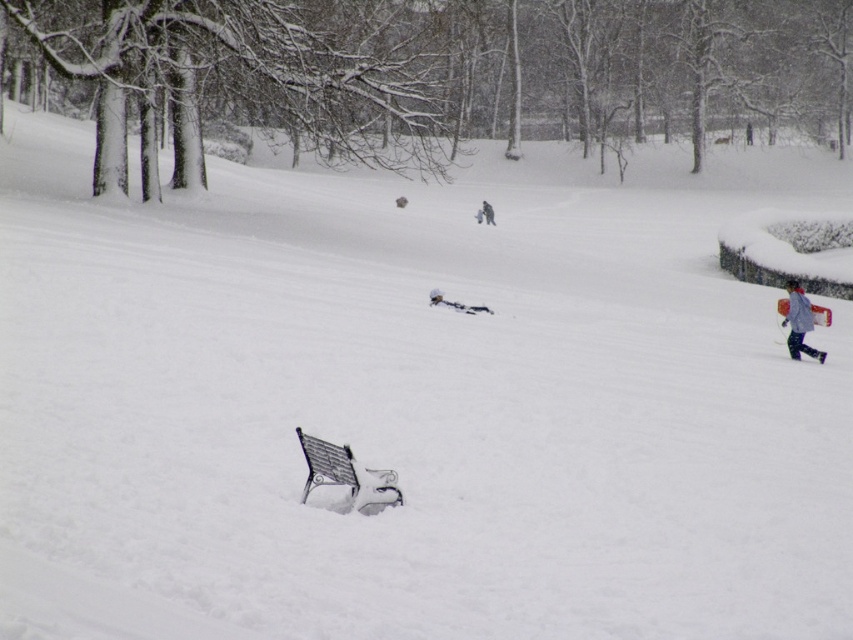
Can you confirm if light blue fabric jacket at right is smaller than light blue fabric snowsuit at center?

Incorrect, light blue fabric jacket at right is not smaller in size than light blue fabric snowsuit at center.

Is light blue fabric jacket at right closer to camera compared to light blue fabric snowsuit at center?

Yes.

The width and height of the screenshot is (853, 640). Find the location of `light blue fabric jacket at right`. light blue fabric jacket at right is located at coordinates (799, 323).

Which is more to the right, light blue fabric jacket at right or white snowboard at center?

Positioned to the right is light blue fabric jacket at right.

Between light blue fabric jacket at right and white snowboard at center, which one has less height?

Standing shorter between the two is white snowboard at center.

Find the location of a particular element. The width and height of the screenshot is (853, 640). light blue fabric jacket at right is located at coordinates (799, 323).

Locate an element on the screen. The image size is (853, 640). light blue fabric jacket at right is located at coordinates (799, 323).

Consider the image. Can you confirm if light blue fabric jacket at right is positioned below white matte ski at right?

Incorrect, light blue fabric jacket at right is not positioned below white matte ski at right.

Looking at this image, measure the distance from light blue fabric jacket at right to white matte ski at right.

2.96 inches

Does point (811, 310) lie behind point (795, 342)?

Yes, point (811, 310) is behind point (795, 342).

You are a GUI agent. You are given a task and a screenshot of the screen. Output one action in this format:
    pyautogui.click(x=<x>, y=<y>)
    Task: Click on the light blue fabric jacket at right
    
    Given the screenshot: What is the action you would take?
    pyautogui.click(x=799, y=323)